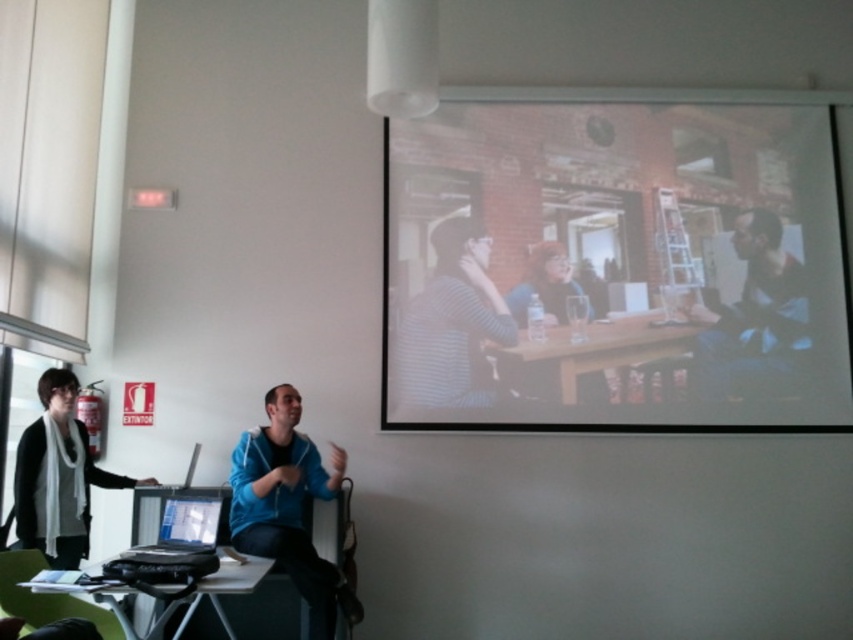
Is point (584, 364) farther from viewer compared to point (193, 454)?

Yes, point (584, 364) is farther from viewer.

Which is above, wooden table at center or silver metallic laptop at lower left?

wooden table at center is higher up.

This screenshot has width=853, height=640. Find the location of `wooden table at center`. wooden table at center is located at coordinates (589, 353).

Where is `wooden table at center`? Image resolution: width=853 pixels, height=640 pixels. wooden table at center is located at coordinates (589, 353).

Consider the image. Which of these two, striped fabric at center or white scarf at left, stands taller?

striped fabric at center is taller.

Consider the image. Is striped fabric at center taller than white scarf at left?

Yes, striped fabric at center is taller than white scarf at left.

Does point (410, 340) lie behind point (56, 422)?

Yes, it is behind point (56, 422).

Locate an element on the screen. Image resolution: width=853 pixels, height=640 pixels. striped fabric at center is located at coordinates (453, 323).

Does point (769, 253) come behind point (167, 484)?

Yes, it is.

From the picture: Does dark blue shirt at upper right have a lesser height compared to silver metallic laptop at lower left?

No, dark blue shirt at upper right is not shorter than silver metallic laptop at lower left.

Is point (755, 355) less distant than point (189, 483)?

No, it is not.

Locate an element on the screen. This screenshot has width=853, height=640. dark blue shirt at upper right is located at coordinates (753, 310).